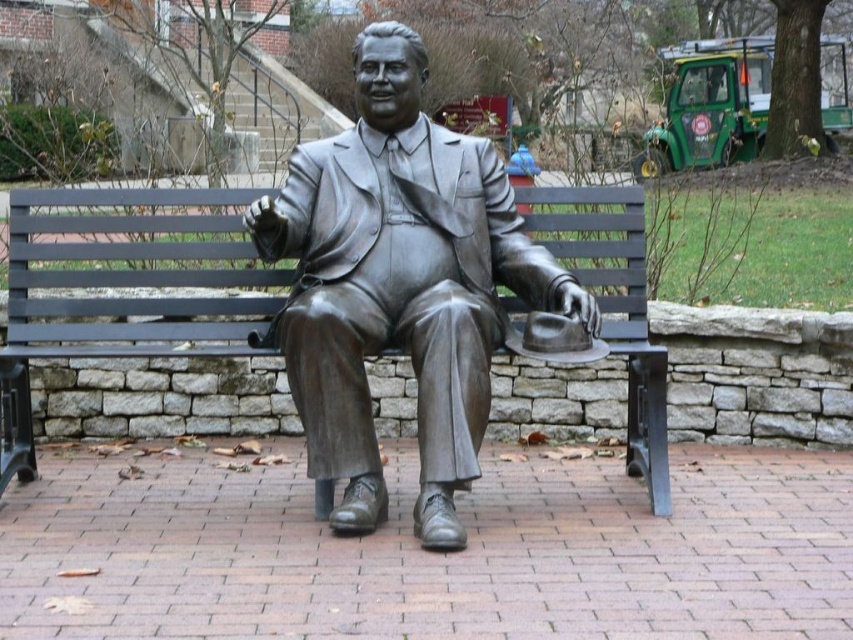
Question: Is bronze statue at center smaller than black metal bench at center?

Choices:
 (A) yes
 (B) no

Answer: (B)

Question: Is bronze statue at center below black metal bench at center?

Choices:
 (A) no
 (B) yes

Answer: (A)

Question: Can you confirm if bronze statue at center is bigger than black metal bench at center?

Choices:
 (A) no
 (B) yes

Answer: (B)

Question: Among these objects, which one is nearest to the camera?

Choices:
 (A) bronze statue at center
 (B) black metal bench at center

Answer: (A)

Question: Which object is farther from the camera taking this photo?

Choices:
 (A) bronze statue at center
 (B) black metal bench at center

Answer: (B)